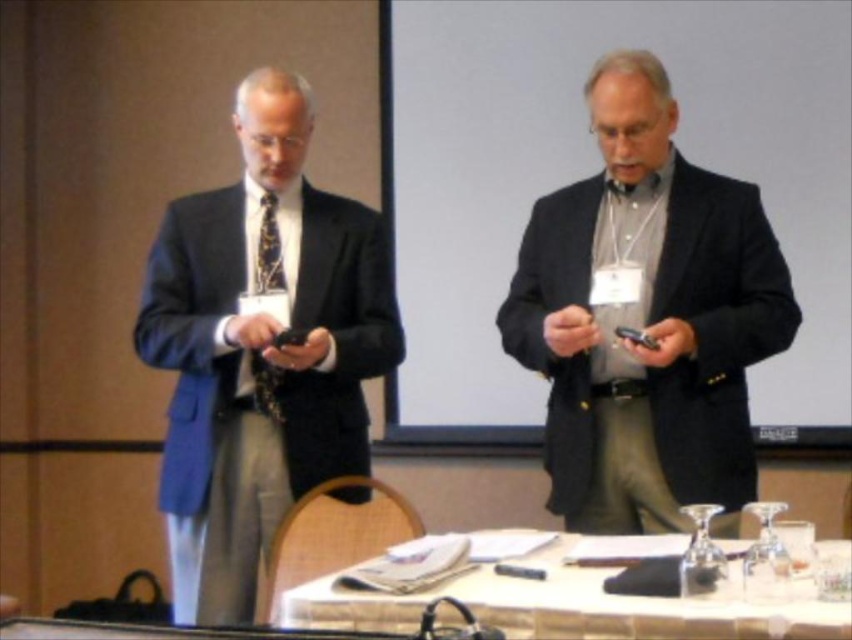
Question: Is matte black suit at left to the left of white glossy table at lower center from the viewer's perspective?

Choices:
 (A) no
 (B) yes

Answer: (B)

Question: In this image, where is matte black suit at center located relative to matte black suit at left?

Choices:
 (A) left
 (B) right

Answer: (B)

Question: Which point is closer to the camera?

Choices:
 (A) (170, 515)
 (B) (689, 362)

Answer: (B)

Question: Which point is farther to the camera?

Choices:
 (A) (634, 490)
 (B) (298, 612)
 (C) (302, 216)

Answer: (C)

Question: Which of the following is the closest to the observer?

Choices:
 (A) white glossy table at lower center
 (B) matte black suit at left
 (C) matte black suit at center

Answer: (A)

Question: Is matte black suit at left above white glossy table at lower center?

Choices:
 (A) yes
 (B) no

Answer: (A)